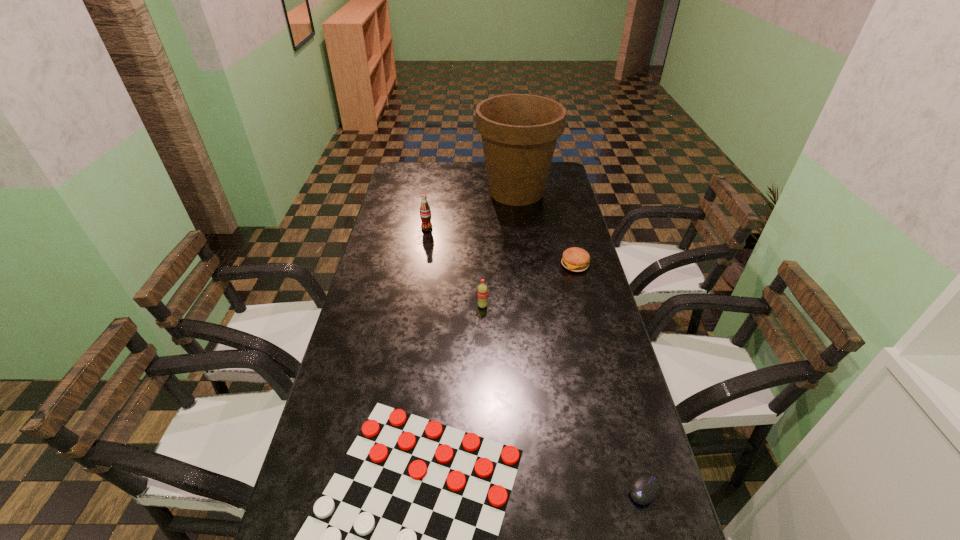
Where is `vacant space at the left edge of the desktop`? The height and width of the screenshot is (540, 960). vacant space at the left edge of the desktop is located at coordinates (394, 313).

Identify the location of vacant space at the right edge of the desktop. (552, 241).

The image size is (960, 540). In order to click on free location at the far right corner in this screenshot , I will do `click(549, 181)`.

This screenshot has height=540, width=960. I want to click on unoccupied position between the tallest object and the third shortest object, so tap(545, 228).

Locate an element on the screen. The image size is (960, 540). vacant space in between the third nearest object and the farthest object is located at coordinates (499, 249).

Where is `free spot between the computer mouse and the fourth tallest object`? This screenshot has height=540, width=960. free spot between the computer mouse and the fourth tallest object is located at coordinates (610, 377).

Where is `unoccupied position between the fourth nearest object and the right soda`? unoccupied position between the fourth nearest object and the right soda is located at coordinates (529, 286).

Find the location of a particular element. The image size is (960, 540). vacant point located between the nearer soda and the fifth tallest object is located at coordinates (564, 398).

Locate an element on the screen. This screenshot has height=540, width=960. blank region between the fifth nearest object and the fifth tallest object is located at coordinates (536, 359).

Find the location of a particular element. This screenshot has height=540, width=960. free space between the farthest object and the second shortest object is located at coordinates (580, 341).